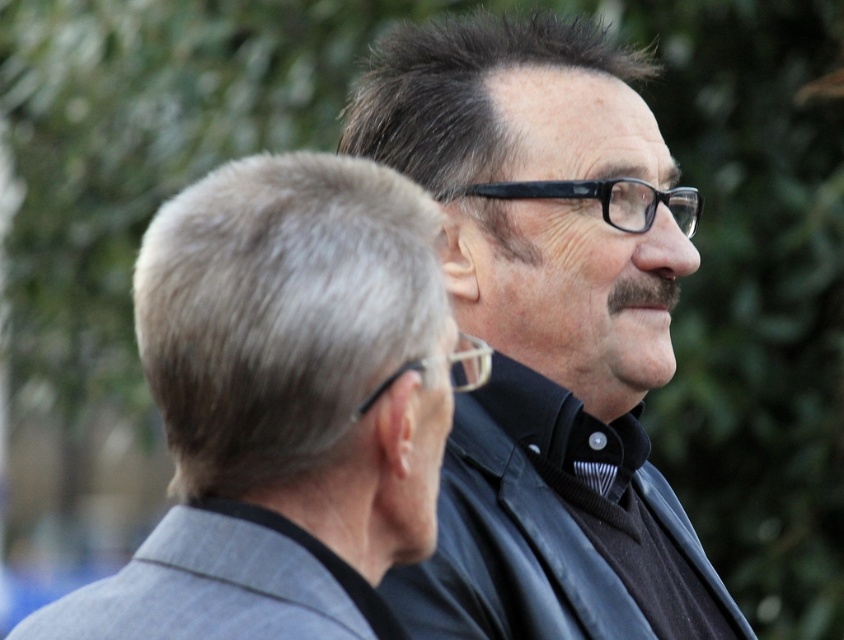
Question: Which point is farther from the camera taking this photo?

Choices:
 (A) (352, 220)
 (B) (501, 20)

Answer: (B)

Question: Does black matte shirt at center appear under gray pinstripe suit at center?

Choices:
 (A) yes
 (B) no

Answer: (A)

Question: Is black matte shirt at center below gray pinstripe suit at center?

Choices:
 (A) no
 (B) yes

Answer: (B)

Question: Can you confirm if black matte shirt at center is positioned above gray pinstripe suit at center?

Choices:
 (A) yes
 (B) no

Answer: (B)

Question: Which object appears closest to the camera in this image?

Choices:
 (A) gray pinstripe suit at center
 (B) black matte shirt at center

Answer: (A)